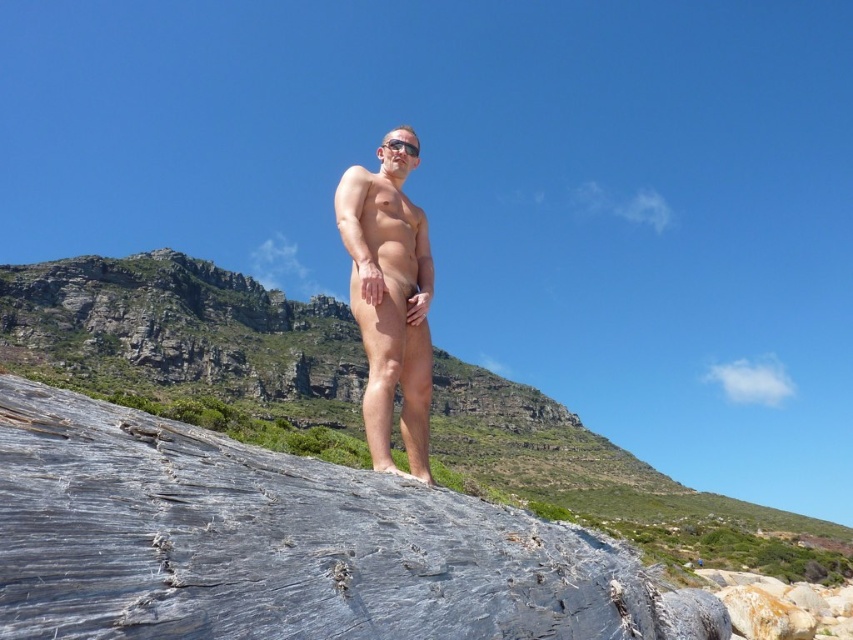
Is gray rough rock at lower left bigger than matte skin at center?

Yes.

Is the position of gray rough rock at lower left less distant than that of matte skin at center?

Yes, gray rough rock at lower left is in front of matte skin at center.

Who is more distant from viewer, (305, 602) or (399, 380)?

The point (399, 380) is more distant.

Where is `gray rough rock at lower left`? This screenshot has height=640, width=853. gray rough rock at lower left is located at coordinates coord(283,545).

Who is shorter, gray rough rock at center or matte skin at center?

matte skin at center is shorter.

From the picture: Which is more to the right, gray rough rock at center or matte skin at center?

matte skin at center is more to the right.

Who is more forward, [207,374] or [383,404]?

Point [383,404]

Find the location of a particular element. This screenshot has width=853, height=640. gray rough rock at center is located at coordinates (184, 339).

Is gray rough rock at lower left further to camera compared to gray rough rock at center?

No, it is not.

Does gray rough rock at lower left have a larger size compared to gray rough rock at center?

Actually, gray rough rock at lower left might be smaller than gray rough rock at center.

Find the location of `gray rough rock at lower left`. gray rough rock at lower left is located at coordinates (283, 545).